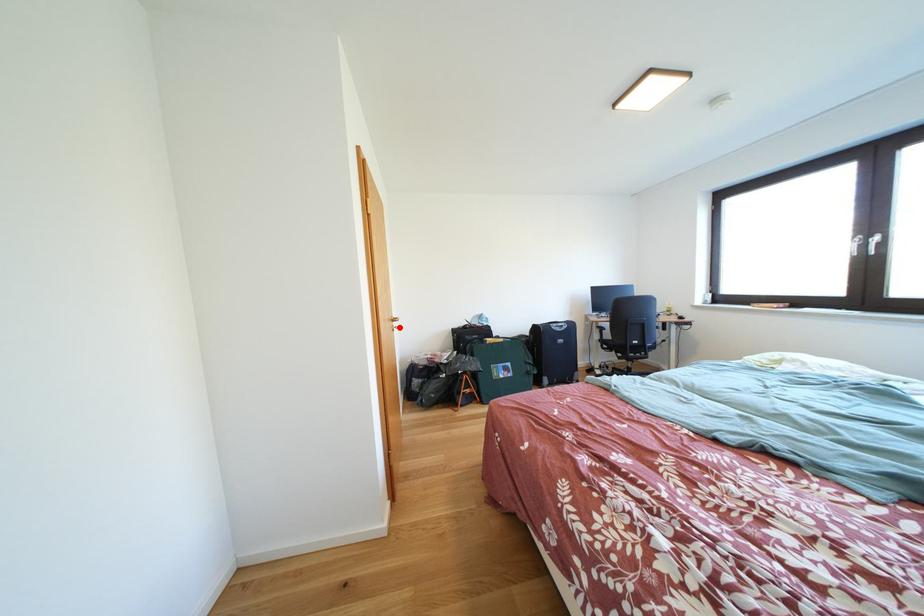
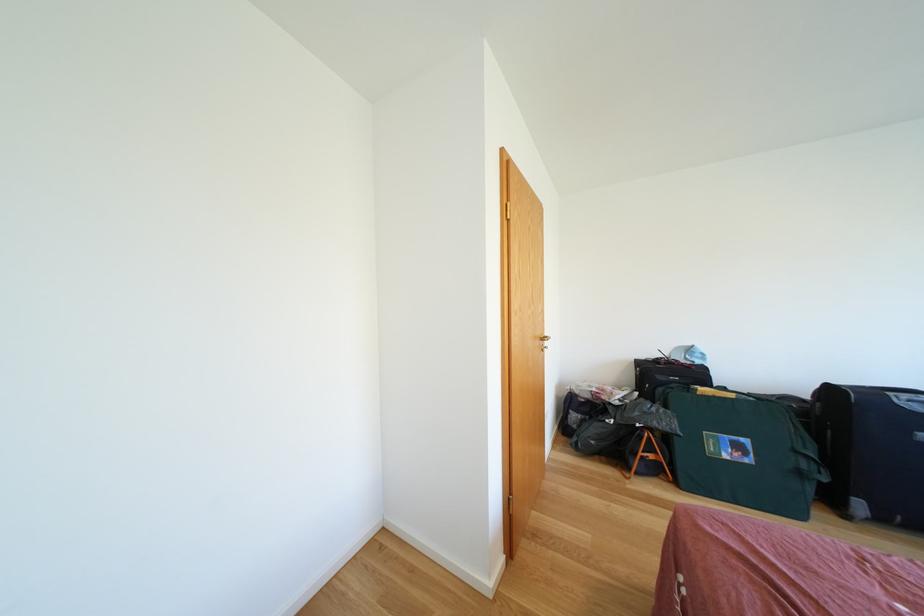
In the second image, find the point that corresponds to the highlighted location in the first image.

(546, 346)